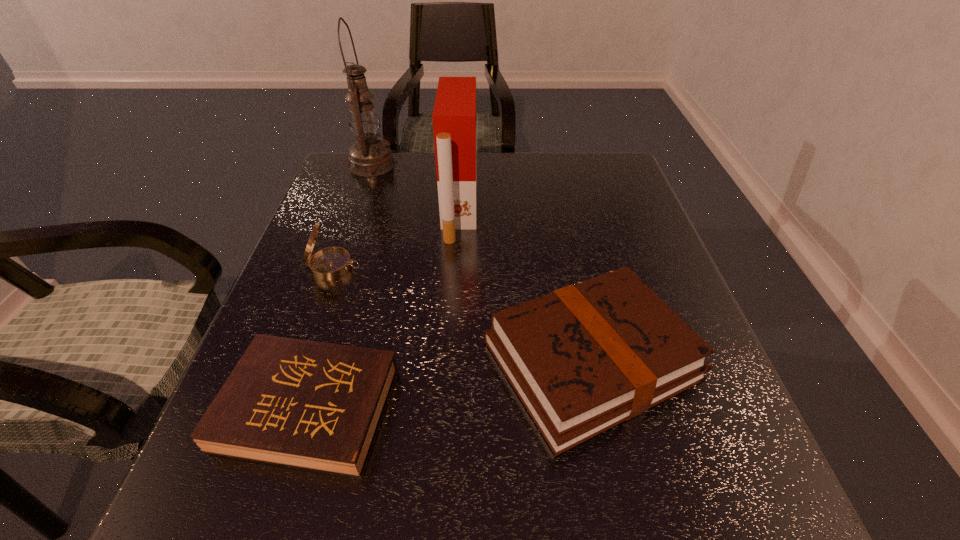
This screenshot has height=540, width=960. In order to click on hardback book that is at the left edge in this screenshot , I will do `click(312, 405)`.

Locate an element on the screen. The image size is (960, 540). object at the right edge is located at coordinates (584, 358).

Find the location of a particular element. object present at the far left corner is located at coordinates (369, 156).

Where is `object present at the near left corner`? The image size is (960, 540). object present at the near left corner is located at coordinates (312, 405).

Where is `vacant region at the far edge of the desktop`? Image resolution: width=960 pixels, height=540 pixels. vacant region at the far edge of the desktop is located at coordinates (512, 161).

This screenshot has height=540, width=960. What are the coordinates of `vacant space at the near edge of the desktop` in the screenshot? It's located at (589, 492).

Locate an element on the screen. blank space at the left edge of the desktop is located at coordinates (359, 243).

In the image, there is a desktop. At what (x,y) coordinates should I click in order to perform the action: click on vacant space at the right edge. Please return your answer as a coordinate pair (x, y). This screenshot has height=540, width=960. Looking at the image, I should click on (646, 255).

Find the location of a particular element. The width and height of the screenshot is (960, 540). vacant area at the far right corner is located at coordinates (601, 156).

Find the location of a particular element. The height and width of the screenshot is (540, 960). unoccupied area between the cigarette case and the oil lamp is located at coordinates (416, 187).